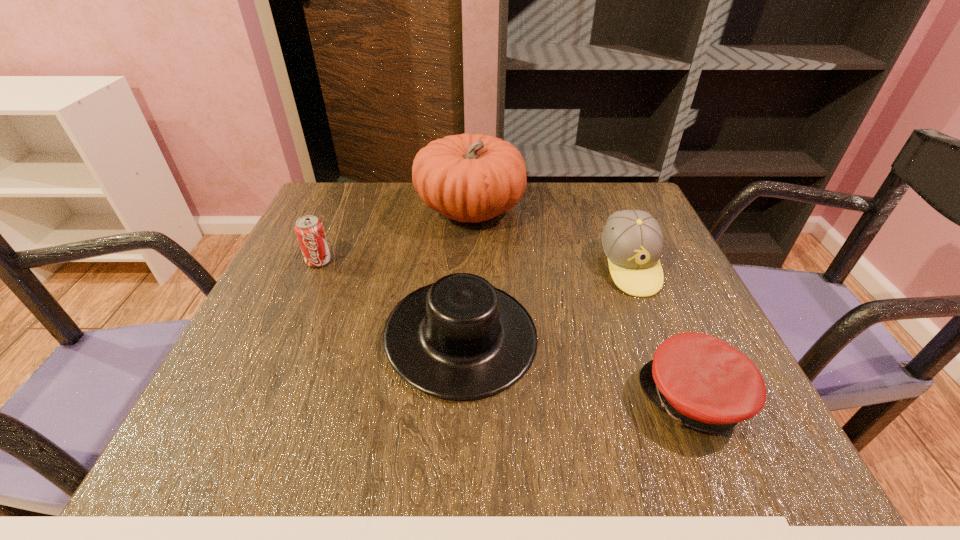
Identify the location of pumpkin. This screenshot has height=540, width=960. (468, 177).

This screenshot has width=960, height=540. I want to click on soda can, so [309, 229].

This screenshot has height=540, width=960. Find the location of `baseball cap`. baseball cap is located at coordinates (632, 240).

I want to click on dress hat, so tap(460, 338).

At what (x,y) coordinates should I click in order to perform the action: click on cap. Please return your answer as a coordinate pair (x, y). The height and width of the screenshot is (540, 960). Looking at the image, I should click on [x=702, y=382].

You are a GUI agent. You are given a task and a screenshot of the screen. Output one action in this format:
    pyautogui.click(x=<x>, y=<y>)
    Task: Click on the vacant space located 0.210m on the left of the pumpkin
    
    Given the screenshot: What is the action you would take?
    pyautogui.click(x=332, y=210)

This screenshot has height=540, width=960. I want to click on vacant region located 0.080m on the front of the leftmost object, so click(x=303, y=295).

At what (x,y) coordinates should I click in order to perform the action: click on free space located on the front-facing side of the baseball cap. Please return your answer as a coordinate pair (x, y). Looking at the image, I should click on (668, 363).

You are a GUI agent. You are given a task and a screenshot of the screen. Output one action in this format:
    pyautogui.click(x=<x>, y=<y>)
    Task: Click on the vacant space located 0.180m on the left of the dress hat
    
    Given the screenshot: What is the action you would take?
    pyautogui.click(x=285, y=336)

At what (x,y) coordinates should I click in order to perform the action: click on vacant space situated at the front of the cap where the visor is located. Please return your answer as a coordinate pair (x, y). This screenshot has width=960, height=540. Looking at the image, I should click on (530, 399).